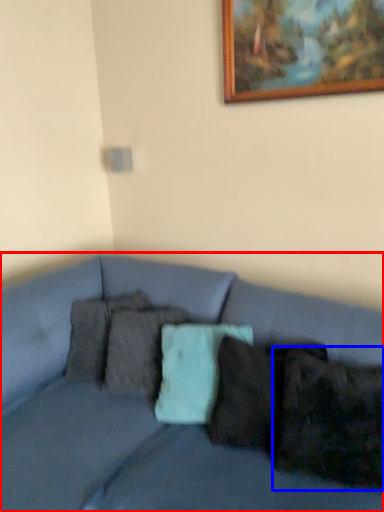
Question: Which object is closer to the camera taking this photo, studio couch (highlighted by a red box) or pillow (highlighted by a blue box)?

Choices:
 (A) studio couch
 (B) pillow

Answer: (A)